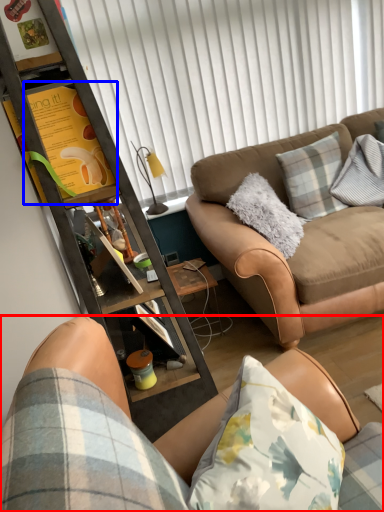
Question: Which object appears farthest to the camera in this image, studio couch (highlighted by a red box) or bulletin board (highlighted by a blue box)?

Choices:
 (A) studio couch
 (B) bulletin board

Answer: (B)